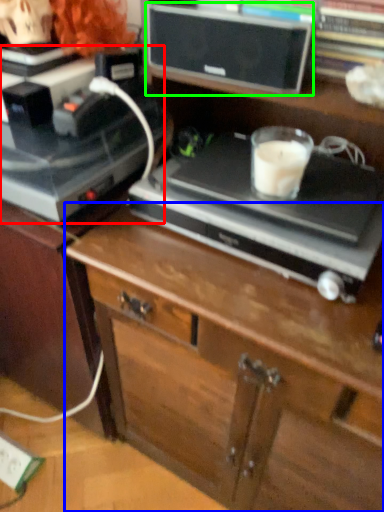
Question: Estimate the real-world distances between objects in this image. Which object is closer to appliance (highlighted by a red box), chest of drawers (highlighted by a blue box) or speaker (highlighted by a green box)?

Choices:
 (A) chest of drawers
 (B) speaker

Answer: (B)